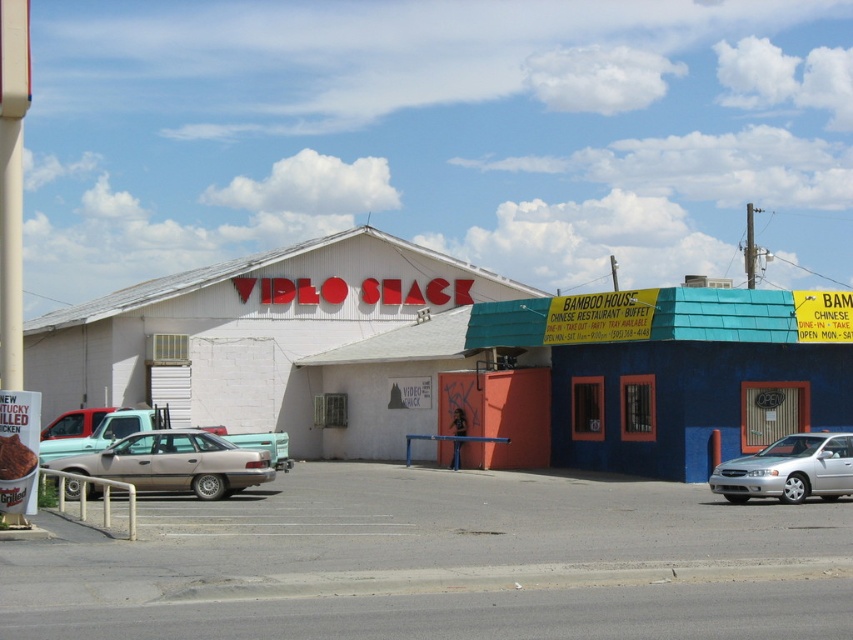
Which is above, matte gray sedan at center-left or silver metallic sedan at center-left?

silver metallic sedan at center-left

Locate an element on the screen. matte gray sedan at center-left is located at coordinates (177, 461).

Is gray asphalt parking lot at center bigger than matte gray sedan at center-left?

Correct, gray asphalt parking lot at center is larger in size than matte gray sedan at center-left.

At what (x,y) coordinates should I click in order to perform the action: click on gray asphalt parking lot at center. Please return your answer as a coordinate pair (x, y). Looking at the image, I should click on (440, 563).

What are the coordinates of `gray asphalt parking lot at center` in the screenshot? It's located at (440, 563).

Does gray asphalt parking lot at center lie behind silver metallic sedan at right?

No.

Can you confirm if gray asphalt parking lot at center is positioned below silver metallic sedan at right?

Yes.

Describe the element at coordinates (440, 563) in the screenshot. This screenshot has height=640, width=853. I see `gray asphalt parking lot at center` at that location.

Identify the location of gray asphalt parking lot at center. The height and width of the screenshot is (640, 853). (440, 563).